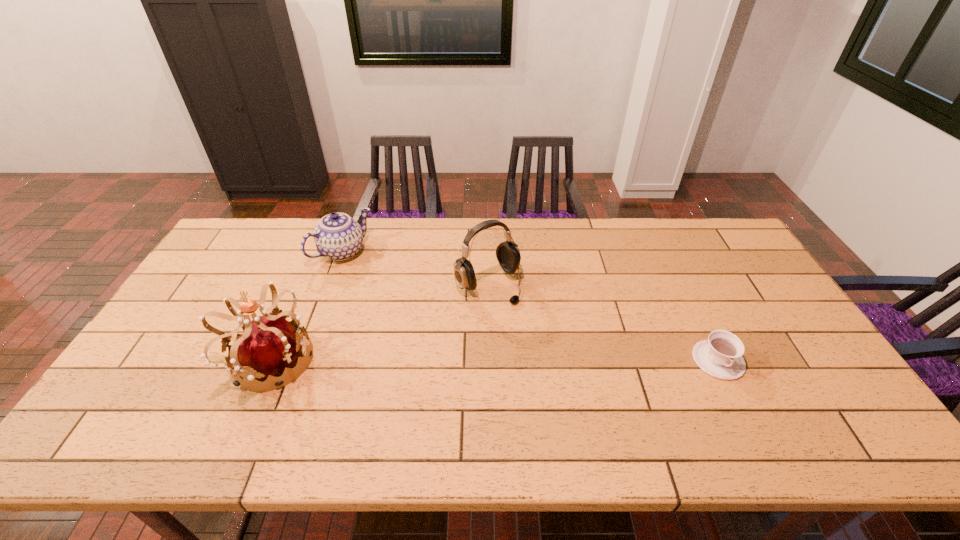
This screenshot has width=960, height=540. What are the coordinates of `free area in between the third object from left to right and the teacup` in the screenshot? It's located at (603, 322).

This screenshot has width=960, height=540. Identify the location of vacant space in between the chinaware and the tiara. (306, 306).

This screenshot has width=960, height=540. In order to click on free space between the tiara and the teacup in this screenshot , I will do `click(493, 360)`.

Where is `empty space between the third tallest object and the tiara`? empty space between the third tallest object and the tiara is located at coordinates (306, 306).

Identify the location of vacant area that lies between the teacup and the third object from left to right. This screenshot has height=540, width=960. (603, 322).

I want to click on vacant area that lies between the headset and the tiara, so click(x=379, y=322).

Locate an element on the screen. The width and height of the screenshot is (960, 540). vacant area that lies between the second shortest object and the rightmost object is located at coordinates (531, 306).

Where is `free space between the tiara and the headset`? This screenshot has height=540, width=960. free space between the tiara and the headset is located at coordinates (379, 322).

Locate an element on the screen. Image resolution: width=960 pixels, height=540 pixels. vacant point located between the rightmost object and the third tallest object is located at coordinates (531, 306).

This screenshot has height=540, width=960. I want to click on the closest object relative to the chinaware, so click(x=270, y=344).